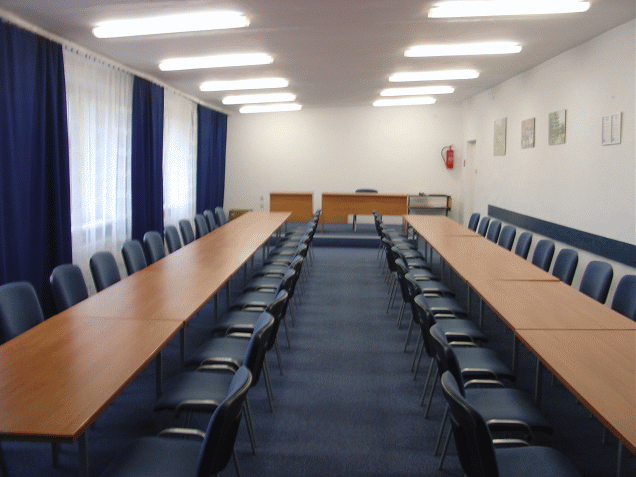
In order to click on empty space between chairs in this screenshot , I will do `click(335, 453)`, `click(332, 379)`, `click(343, 314)`, `click(341, 267)`, `click(347, 239)`.